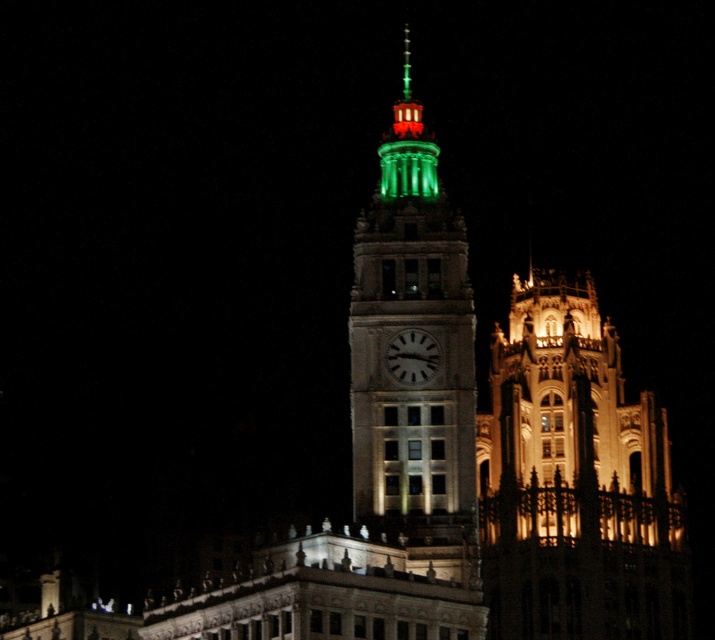
From the picture: You are standing in front of the tower and notice two points marked on the tower. One is at coordinate point (384, 192) and the other at point (404, 364). Which point is closer to you?

Point (384, 192) is further to the camera than point (404, 364), so the point closer to you is point (404, 364).

You are standing in front of the illuminated stone tower at right and want to look at the white glossy clock at center. Which direction should you move to see it better?

The white glossy clock at center is located above the illuminated stone tower at right, so you should look upward to see it better.